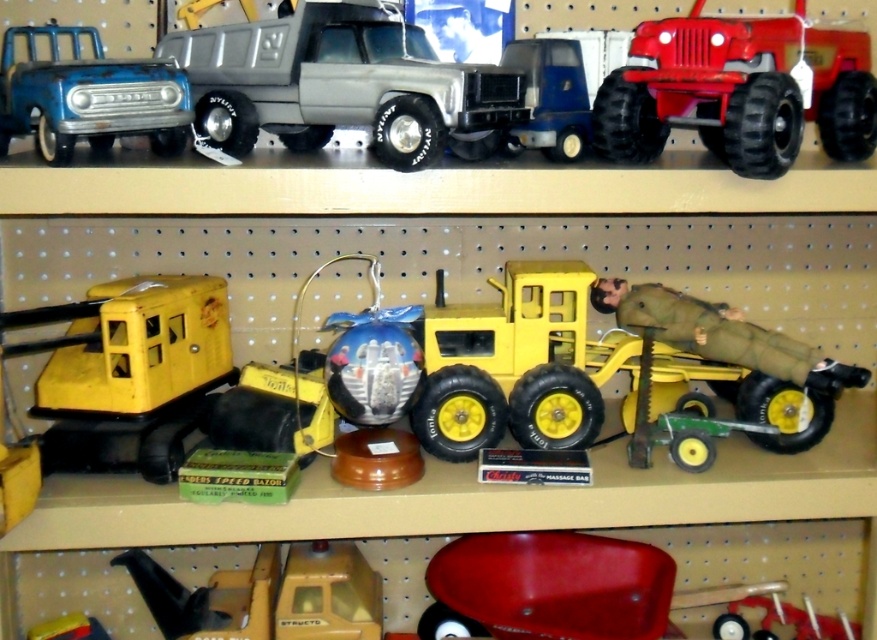
You are trying to locate the matte plastic truck at center on a pegboard shelf. According to the coordinates provided, where exactly is it positioned?

The matte plastic truck at center is located at point coordinates (341, 84).

You are a child trying to reach both the yellow matte truck at center and the matte blue truck at upper left from your current position. The distance between them is 19.02 inches. If your hand can only reach 18 inches, can you grab both trucks without moving your hand?

The yellow matte truck at center and the matte blue truck at upper left are 19.02 inches apart. Since your hand can only reach 18 inches, you cannot grab both trucks without moving your hand because the distance between them exceeds your reach.

In the scene shown: You are organizing a display of toy vehicles and accessories on pegboard shelves. You have two points marked on the top shelf where you need to place a blue truck with a white front and a silver and black truck. The coordinates for these points are point(398,44) and point(672,42). Based on their positions, which point is closer to the back of the shelf?

Point(398,44) is behind point(672,42), so it is closer to the back of the shelf.